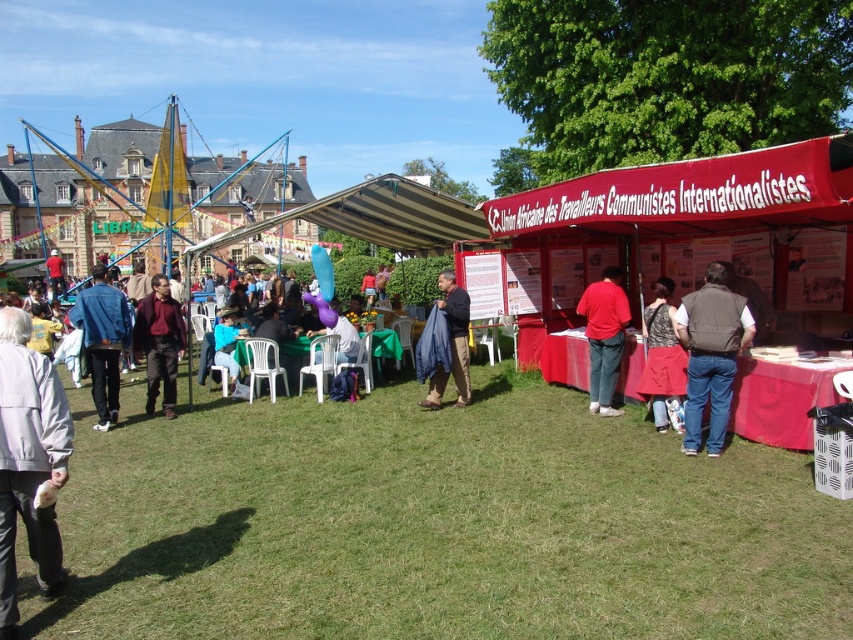
Question: Considering the real-world distances, which object is closest to the gray fabric jacket at lower left?

Choices:
 (A) blue denim jacket at left
 (B) blue fabric jacket at center
 (C) blue fabric chair at lower center

Answer: (A)

Question: Does blue fabric jacket at center have a lesser width compared to dark gray fabric dress at center?

Choices:
 (A) no
 (B) yes

Answer: (A)

Question: Does gray fabric jacket at lower left lie in front of brown vest at center?

Choices:
 (A) yes
 (B) no

Answer: (A)

Question: Among these points, which one is farthest from the camera?

Choices:
 (A) (663, 324)
 (B) (703, 310)
 (C) (9, 525)

Answer: (A)

Question: Is gray fabric jacket at lower left further to camera compared to red matte shirt at center?

Choices:
 (A) yes
 (B) no

Answer: (B)

Question: Among these objects, which one is farthest from the camera?

Choices:
 (A) blue fabric jacket at center
 (B) blue denim jacket at left
 (C) brown vest at center

Answer: (A)